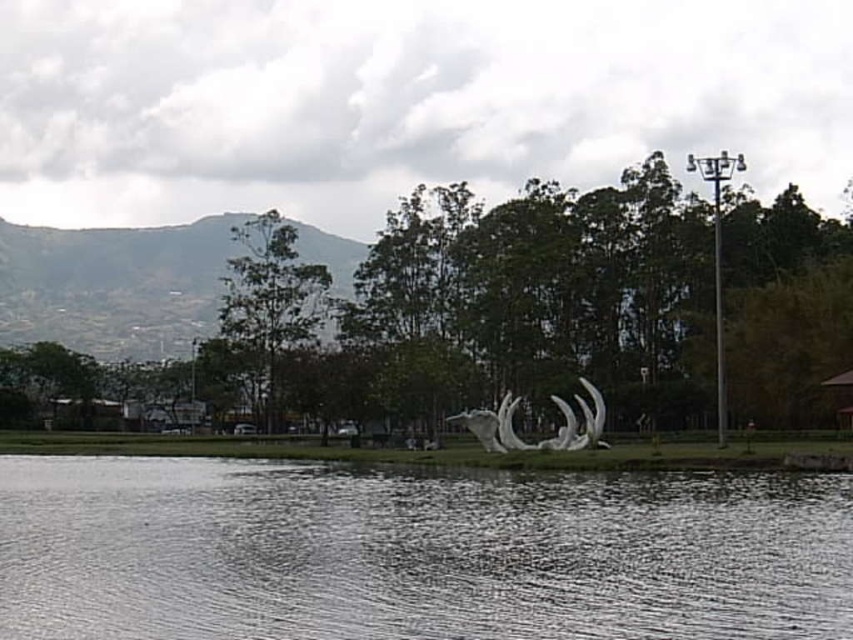
You are standing at the edge of the water in the scene and want to walk to the sculpture in the midground. There are two points marked on your path. Which point, point (813, 513) or point (518, 445), is closer to you as you start walking towards the sculpture?

Point (813, 513) is closer to the viewer than point (518, 445), so the closer point is point (813, 513).